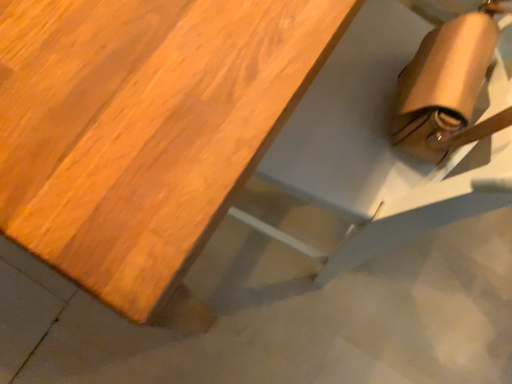
Question: Does wooden table at upper left contain matte brown bag at lower right?

Choices:
 (A) no
 (B) yes

Answer: (B)

Question: Considering the relative positions of wooden table at upper left and matte brown bag at lower right in the image provided, is wooden table at upper left in front of matte brown bag at lower right?

Choices:
 (A) no
 (B) yes

Answer: (B)

Question: Is wooden table at upper left at the left side of matte brown bag at lower right?

Choices:
 (A) no
 (B) yes

Answer: (B)

Question: Can you confirm if wooden table at upper left is thinner than matte brown bag at lower right?

Choices:
 (A) yes
 (B) no

Answer: (B)

Question: Can you confirm if wooden table at upper left is shorter than matte brown bag at lower right?

Choices:
 (A) no
 (B) yes

Answer: (B)

Question: Considering the relative sizes of wooden table at upper left and matte brown bag at lower right in the image provided, is wooden table at upper left smaller than matte brown bag at lower right?

Choices:
 (A) yes
 (B) no

Answer: (B)

Question: Can you confirm if matte brown bag at lower right is taller than wooden table at upper left?

Choices:
 (A) yes
 (B) no

Answer: (A)

Question: Is matte brown bag at lower right oriented towards wooden table at upper left?

Choices:
 (A) yes
 (B) no

Answer: (A)

Question: Does matte brown bag at lower right have a larger size compared to wooden table at upper left?

Choices:
 (A) yes
 (B) no

Answer: (B)

Question: Is matte brown bag at lower right placed right next to wooden table at upper left?

Choices:
 (A) no
 (B) yes

Answer: (A)

Question: From a real-world perspective, is matte brown bag at lower right under wooden table at upper left?

Choices:
 (A) yes
 (B) no

Answer: (B)

Question: Considering the relative positions of matte brown bag at lower right and wooden table at upper left in the image provided, is matte brown bag at lower right to the left of wooden table at upper left from the viewer's perspective?

Choices:
 (A) no
 (B) yes

Answer: (A)

Question: Do you think wooden table at upper left is within matte brown bag at lower right, or outside of it?

Choices:
 (A) inside
 (B) outside

Answer: (B)